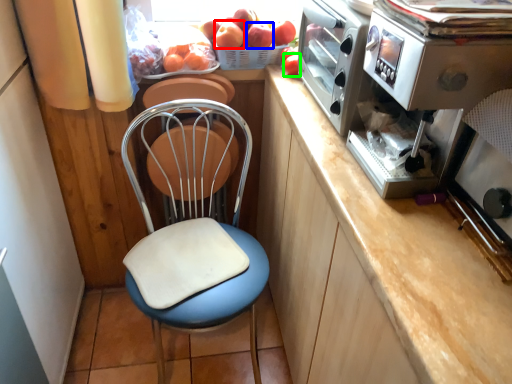
Question: Based on their relative distances, which object is nearer to apple (highlighted by a red box)? Choose from apple (highlighted by a blue box) and fruit (highlighted by a green box).

Choices:
 (A) apple
 (B) fruit

Answer: (A)